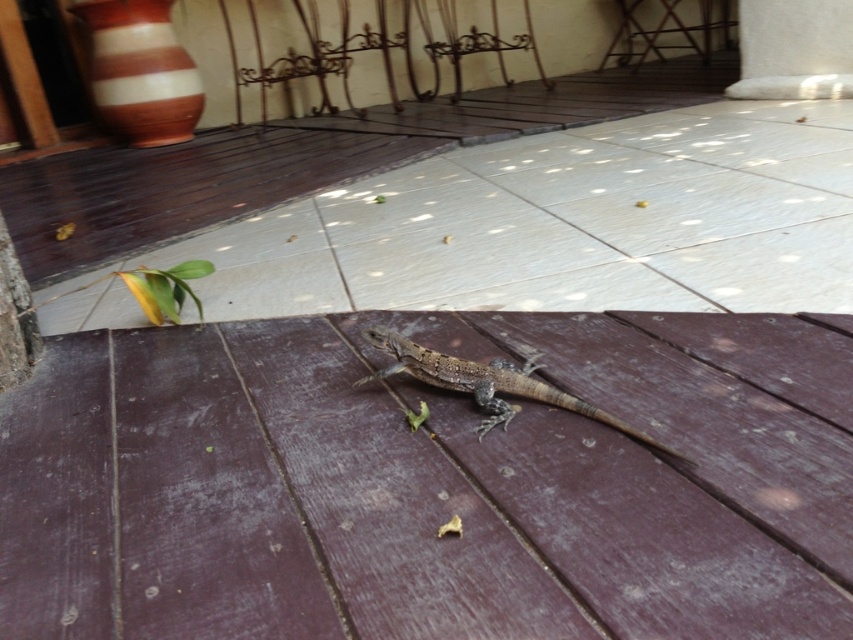
Can you confirm if brown wooden deck at center is positioned to the right of brown scaly lizard at center?

No, brown wooden deck at center is not to the right of brown scaly lizard at center.

Measure the distance between brown wooden deck at center and brown scaly lizard at center.

brown wooden deck at center and brown scaly lizard at center are 9.22 inches apart.

Which is behind, point (604, 522) or point (418, 346)?

Positioned behind is point (418, 346).

Locate an element on the screen. Image resolution: width=853 pixels, height=640 pixels. brown wooden deck at center is located at coordinates (430, 483).